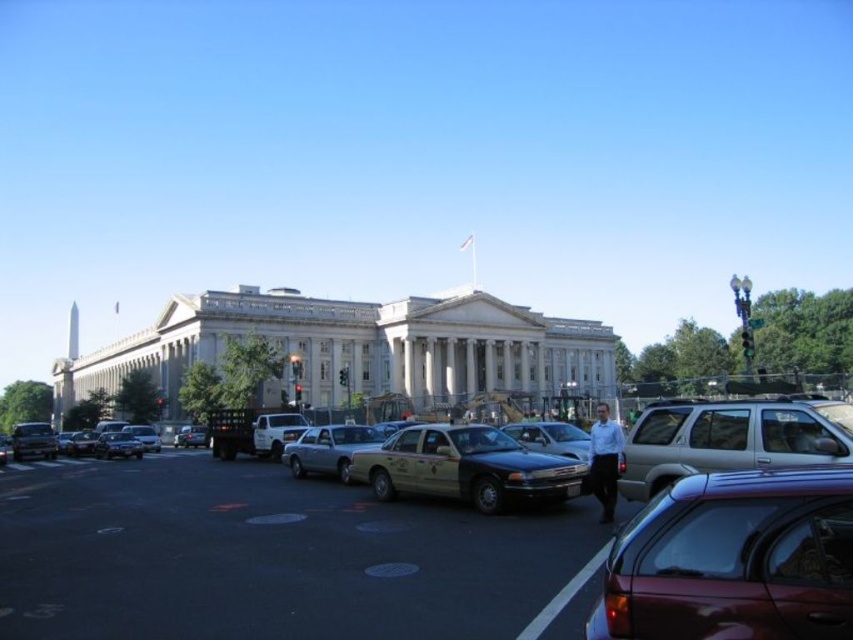
Who is lower down, shiny maroon sedan at lower right or silver metallic taxi at center?

silver metallic taxi at center is lower down.

Between shiny maroon sedan at lower right and silver metallic taxi at center, which one is positioned higher?

Positioned higher is shiny maroon sedan at lower right.

At what (x,y) coordinates should I click in order to perform the action: click on shiny maroon sedan at lower right. Please return your answer as a coordinate pair (x, y). This screenshot has height=640, width=853. Looking at the image, I should click on (734, 560).

The width and height of the screenshot is (853, 640). What do you see at coordinates (730, 438) in the screenshot?
I see `metallic silver suv at lower right` at bounding box center [730, 438].

Between point (808, 406) and point (549, 461), which one is positioned behind?

Point (549, 461)

Identify the location of metallic silver suv at lower right. The image size is (853, 640). (730, 438).

Looking at this image, who is more distant from viewer, (821, 616) or (721, 403)?

The point (721, 403) is behind.

In the scene shown: Who is taller, shiny maroon sedan at lower right or metallic silver suv at lower right?

metallic silver suv at lower right

Does point (672, 547) come in front of point (750, 458)?

Yes.

Identify the location of shiny maroon sedan at lower right. (734, 560).